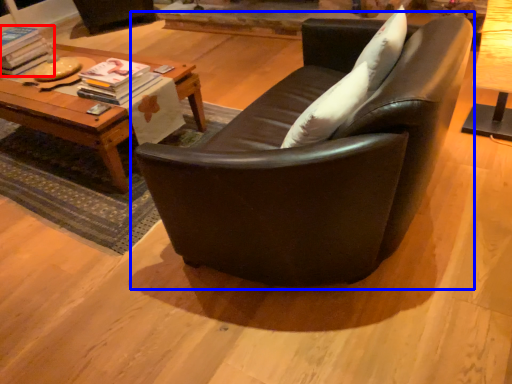
Question: Which object is further to the camera taking this photo, magazine (highlighted by a red box) or studio couch (highlighted by a blue box)?

Choices:
 (A) magazine
 (B) studio couch

Answer: (A)